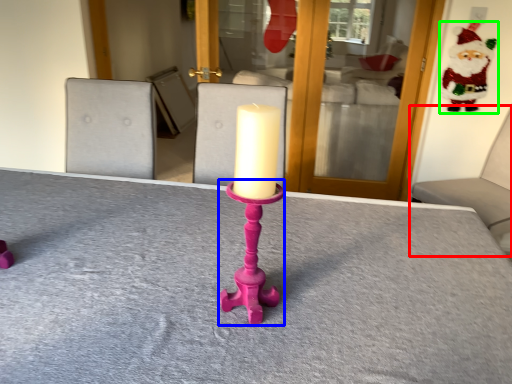
Question: Considering the real-world distances, which object is closest to furniture (highlighted by a red box)? candle holder (highlighted by a blue box) or santa claus (highlighted by a green box).

Choices:
 (A) candle holder
 (B) santa claus

Answer: (B)